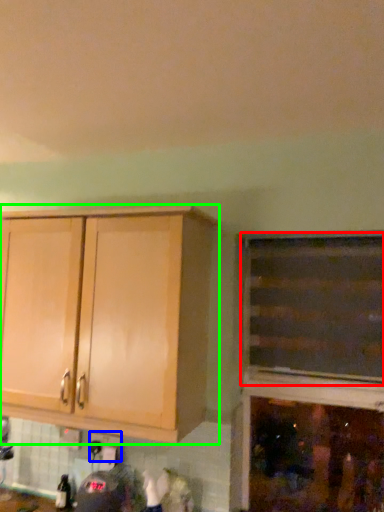
Question: Estimate the real-world distances between objects in this image. Which object is closer to cabinetry (highlighted by a red box), electric outlet (highlighted by a blue box) or cabinetry (highlighted by a green box)?

Choices:
 (A) electric outlet
 (B) cabinetry

Answer: (B)